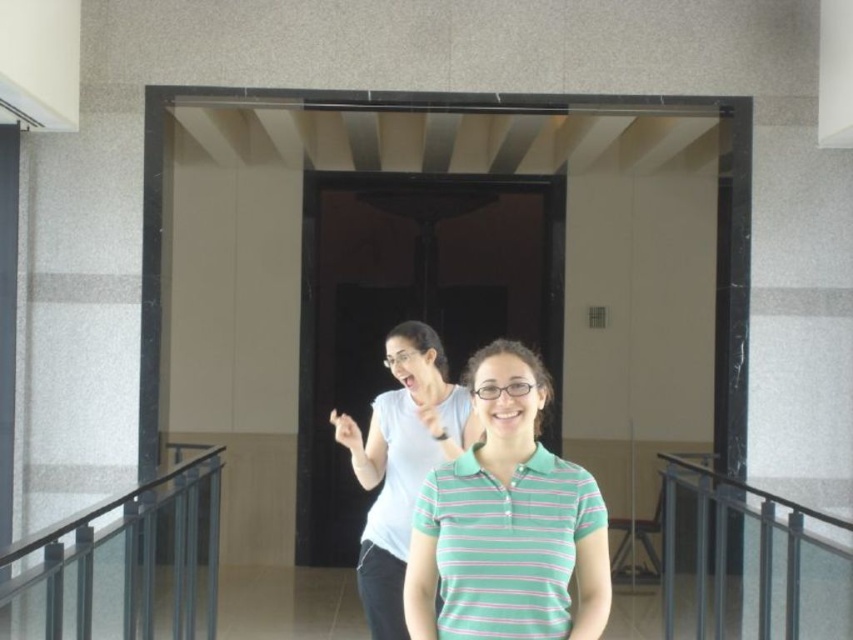
Question: Which point is farther to the camera?

Choices:
 (A) (700, 611)
 (B) (434, 369)
 (C) (450, 492)

Answer: (A)

Question: Estimate the real-world distances between objects in this image. Which object is farther from the green striped polo shirt at center?

Choices:
 (A) white matte shirt at center
 (B) metallic gray railing at lower right

Answer: (B)

Question: Which is farther from the green striped polo shirt at center?

Choices:
 (A) white matte shirt at center
 (B) metallic gray railing at lower right

Answer: (B)

Question: Is green striped polo shirt at center in front of white matte shirt at center?

Choices:
 (A) yes
 (B) no

Answer: (A)

Question: From the image, what is the correct spatial relationship of green striped polo shirt at center in relation to white matte shirt at center?

Choices:
 (A) below
 (B) above

Answer: (B)

Question: Does green striped polo shirt at center have a lesser width compared to white matte shirt at center?

Choices:
 (A) yes
 (B) no

Answer: (A)